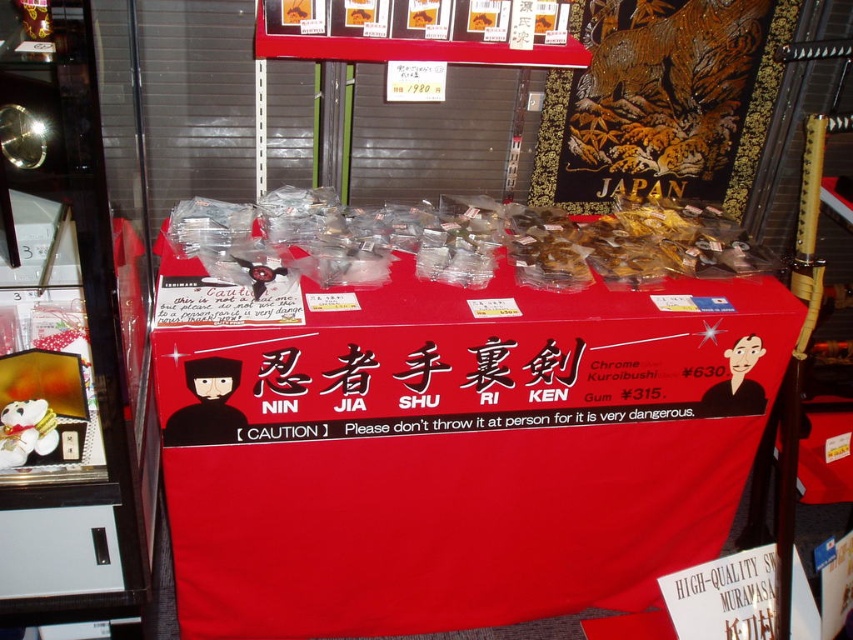
Question: Based on their relative distances, which object is farther from the black matte ninja mask at center?

Choices:
 (A) translucent plastic bags at center
 (B) red fabric tablecloth at center

Answer: (A)

Question: Estimate the real-world distances between objects in this image. Which object is farther from the translucent plastic bags at center?

Choices:
 (A) black matte ninja at center
 (B) red fabric tablecloth at center
 (C) black matte ninja mask at center

Answer: (A)

Question: Which object appears farthest from the camera in this image?

Choices:
 (A) translucent plastic bags at center
 (B) black matte ninja mask at center

Answer: (B)

Question: From the image, what is the correct spatial relationship of red fabric tablecloth at center in relation to black matte ninja at center?

Choices:
 (A) below
 (B) above

Answer: (A)

Question: Is red fabric tablecloth at center smaller than black matte ninja mask at center?

Choices:
 (A) no
 (B) yes

Answer: (A)

Question: Is red fabric tablecloth at center further to camera compared to black matte ninja mask at center?

Choices:
 (A) yes
 (B) no

Answer: (B)